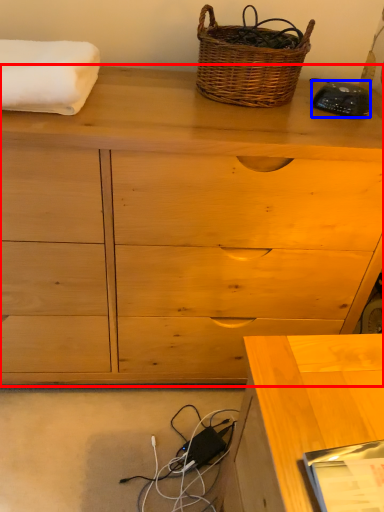
Question: Which of the following is the closest to the observer, chest of drawers (highlighted by a red box) or gadget (highlighted by a blue box)?

Choices:
 (A) chest of drawers
 (B) gadget

Answer: (A)